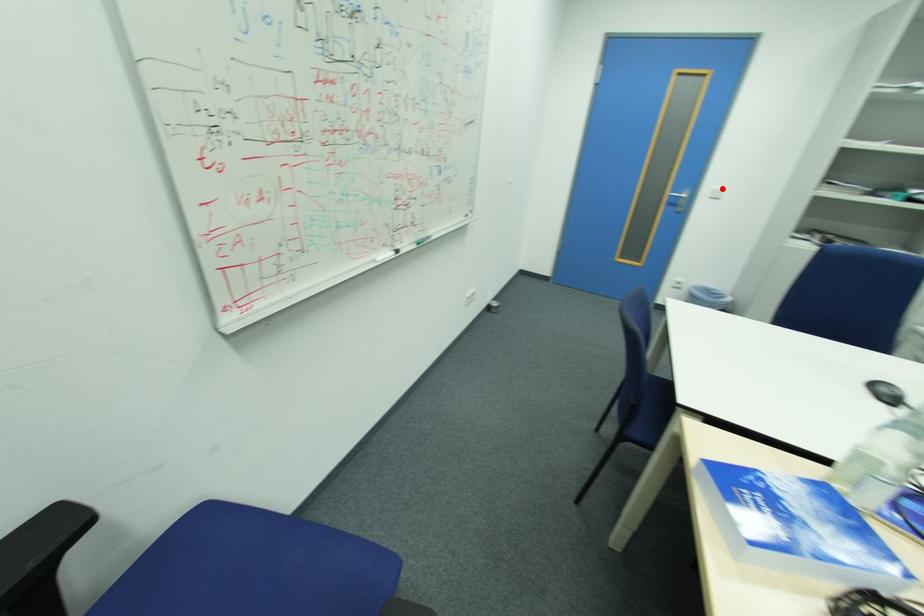
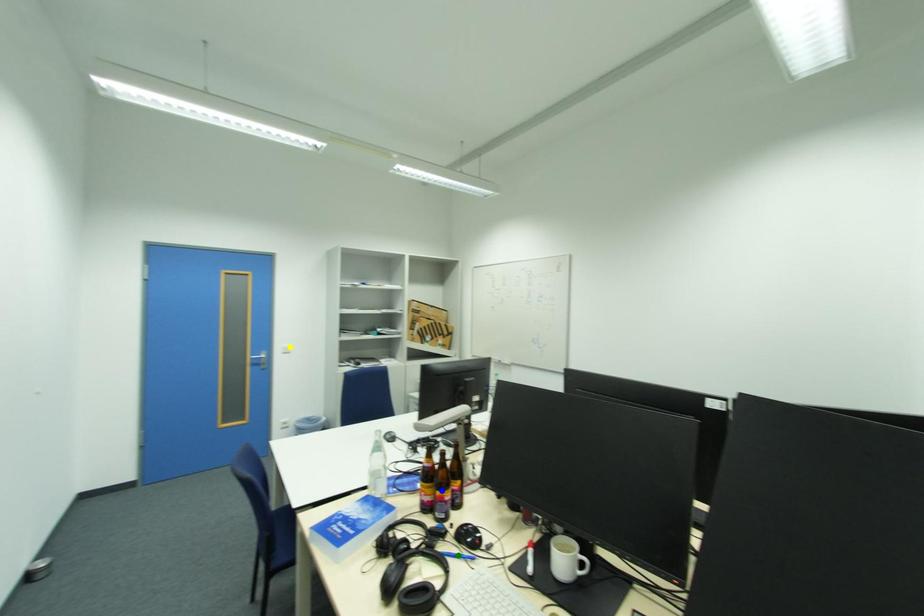
Question: I am providing you with two images of the same scene from different viewpoints. A red point is marked on the first image. You are given multiple points on the second image. Which point in image 2 represents the same 3d spot as the red point in image 1?

Choices:
 (A) yellow point
 (B) blue point
 (C) green point

Answer: (A)